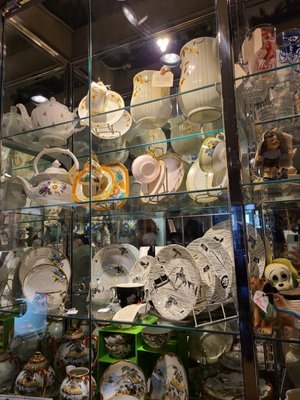
Locate an element on the screen. The image size is (300, 400). teacups on second shelf is located at coordinates (148, 162), (215, 145).